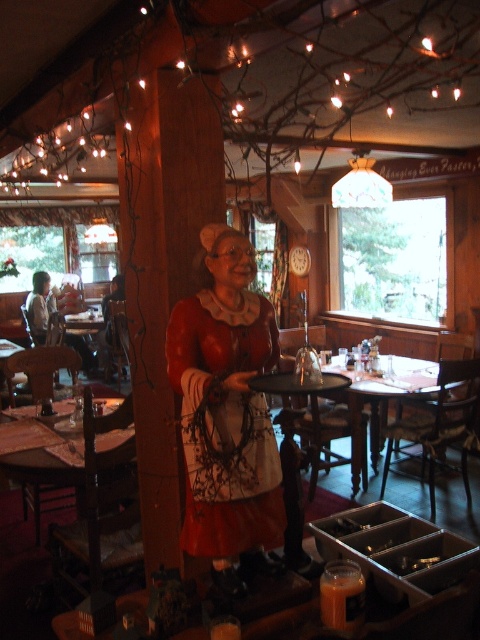
Is matte red dress at center above wooden table at center?

Yes.

Looking at this image, is matte red dress at center smaller than wooden table at center?

Yes, matte red dress at center is smaller than wooden table at center.

Between point (244, 515) and point (352, 406), which one is positioned in front?

Point (244, 515) is in front.

Find the location of a particular element. Image resolution: width=480 pixels, height=640 pixels. matte red dress at center is located at coordinates (227, 412).

I want to click on matte red dress at center, so click(x=227, y=412).

Who is more distant from viewer, (210,244) or (29,461)?

The point (29,461) is behind.

Who is more distant from viewer, (192, 388) or (51, 476)?

Point (51, 476)

You are a GUI agent. You are given a task and a screenshot of the screen. Output one action in this format:
    pyautogui.click(x=<x>, y=<y>)
    Task: Click on the matte red dress at center
    The width and height of the screenshot is (480, 640).
    Given the screenshot: What is the action you would take?
    pyautogui.click(x=227, y=412)

Does matte red dress at center appear under wooden round table at center?

No.

Measure the distance between matte red dress at center and camera.

matte red dress at center and camera are 5.66 feet apart.

Find the location of a particular element. matte red dress at center is located at coordinates (227, 412).